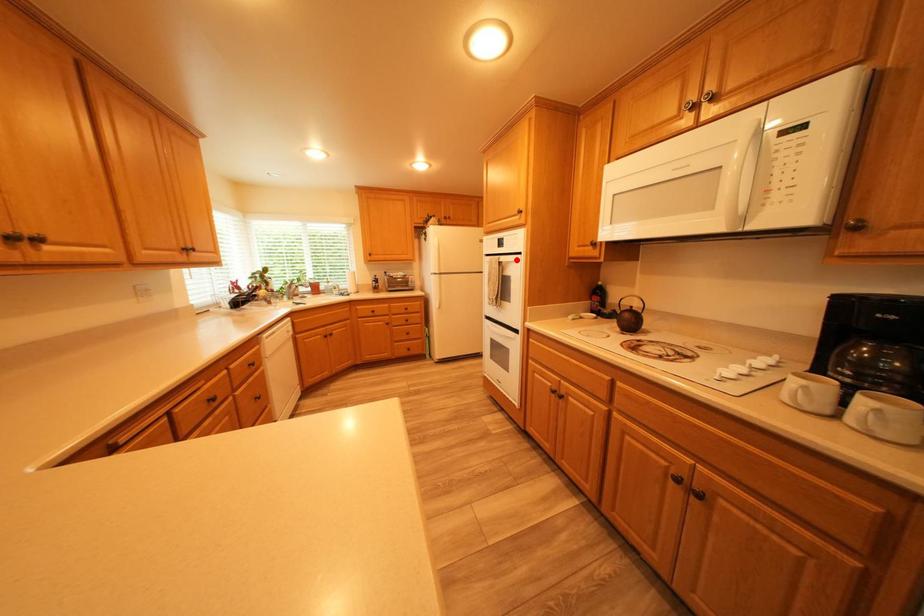
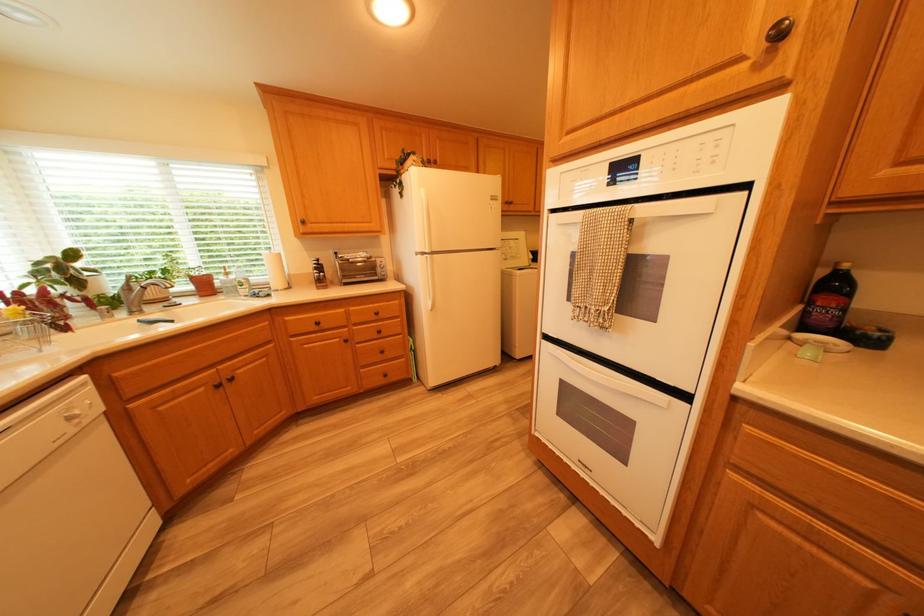
In the second image, find the point that corresponds to the highlighted location in the first image.

(657, 211)